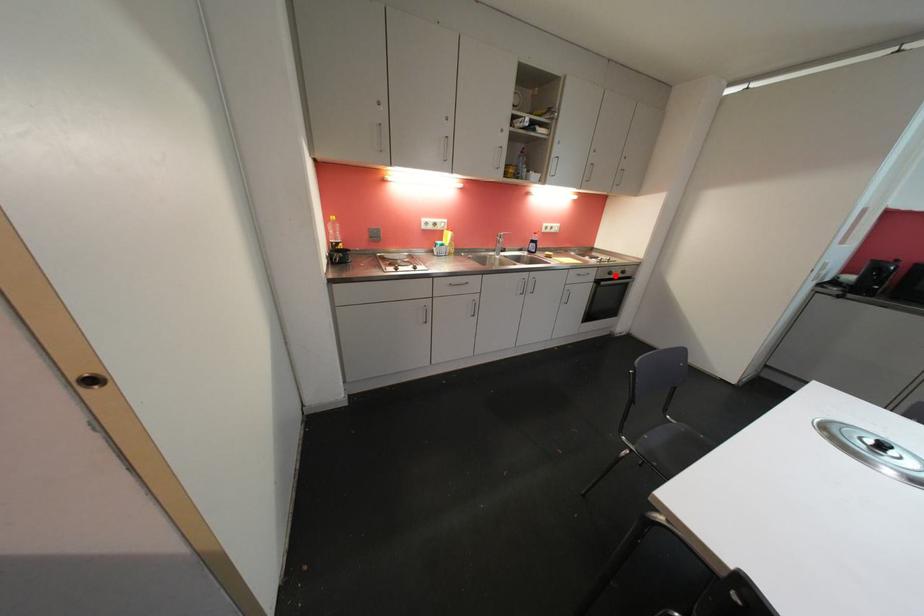
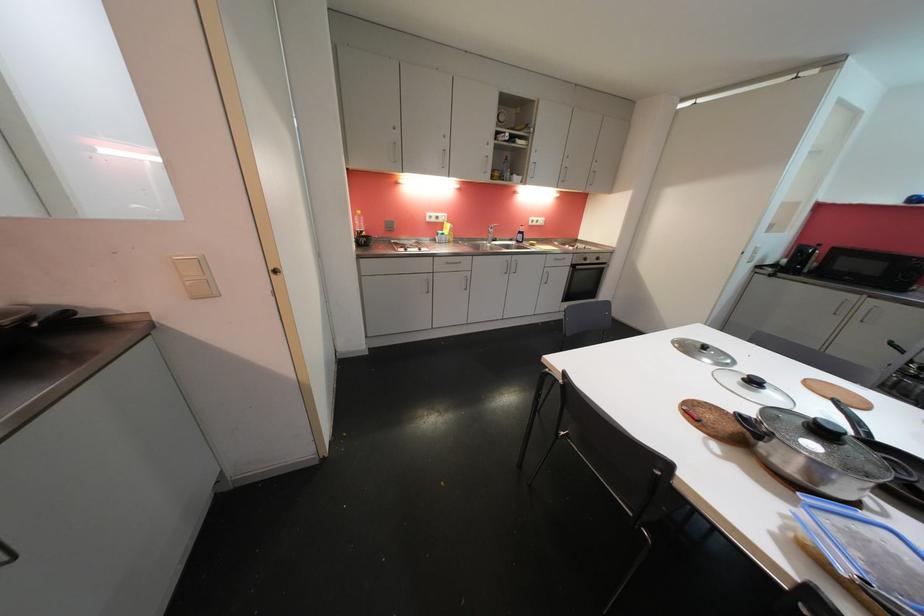
Question: I am providing you with two images of the same scene from different viewpoints. Given a red point in image1, look at the same physical point in image2. Is it:

Choices:
 (A) Closer to the viewpoint
 (B) Farther from the viewpoint

Answer: (A)